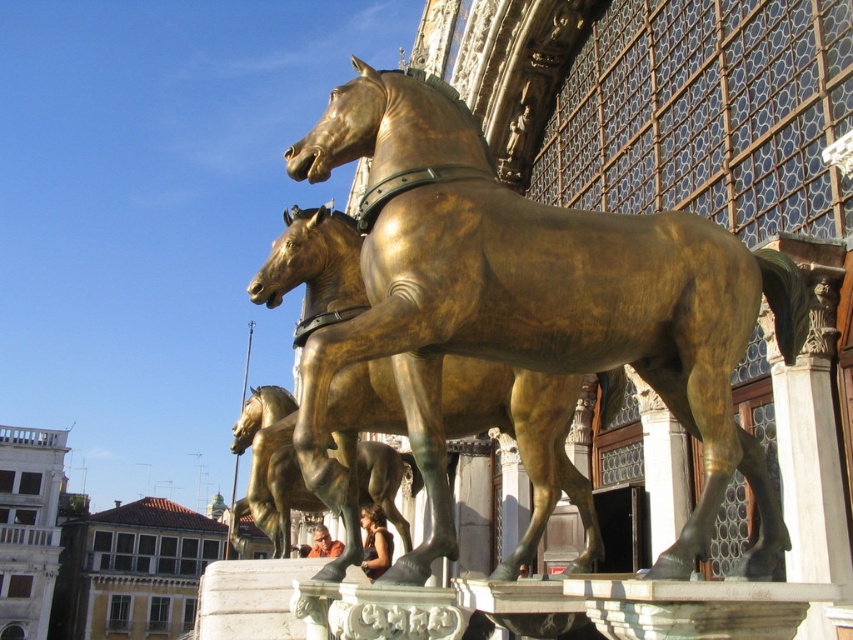
Can you confirm if golden polished horse at center is positioned to the right of shiny gold horse at center?

Correct, you'll find golden polished horse at center to the right of shiny gold horse at center.

Is point (283, 509) closer to viewer compared to point (288, 458)?

No, it is not.

Where is `golden polished horse at center`? The width and height of the screenshot is (853, 640). golden polished horse at center is located at coordinates (524, 442).

Where is `golden polished horse at center`? The image size is (853, 640). golden polished horse at center is located at coordinates (524, 442).

Is gold polished bronze horse at center closer to the viewer compared to shiny gold horse at center?

Yes, gold polished bronze horse at center is in front of shiny gold horse at center.

Where is `gold polished bronze horse at center`? The width and height of the screenshot is (853, 640). gold polished bronze horse at center is located at coordinates (529, 304).

Is point (683, 388) in front of point (368, 449)?

Yes, point (683, 388) is in front of point (368, 449).

Identify the location of gold polished bronze horse at center. (529, 304).

Is point (456, 120) in front of point (345, 413)?

Yes, it is.

Does point (428, 545) come farther from viewer compared to point (548, 490)?

No, it is not.

Where is `gold polished bronze horse at center`? The image size is (853, 640). gold polished bronze horse at center is located at coordinates (529, 304).